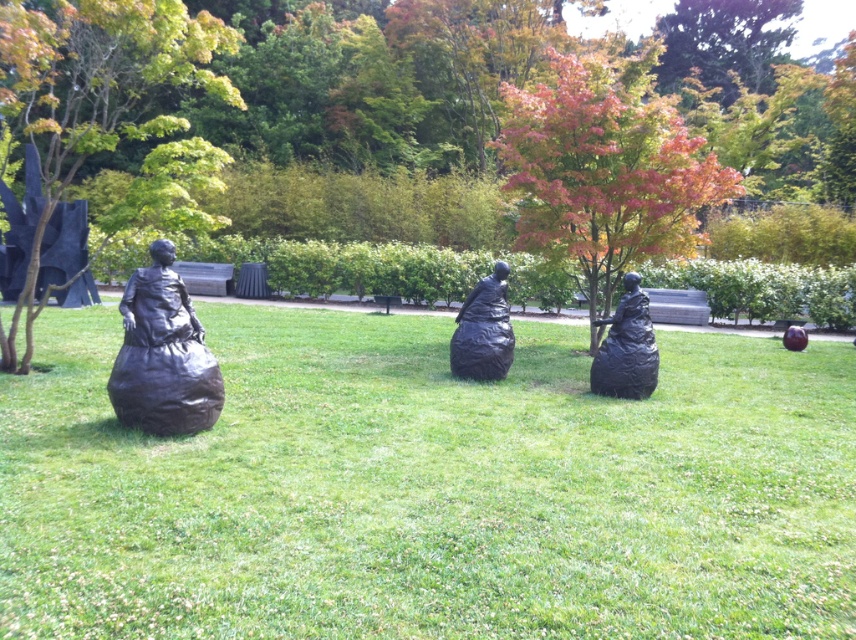
Identify the location of smooth brown tree at center. This screenshot has width=856, height=640. (485, 148).

What do you see at coordinates (485, 148) in the screenshot?
I see `smooth brown tree at center` at bounding box center [485, 148].

At what (x,y) coordinates should I click in order to perform the action: click on smooth brown tree at center. Please return your answer as a coordinate pair (x, y). The width and height of the screenshot is (856, 640). Looking at the image, I should click on (485, 148).

Can you confirm if autumn leaves at center is shorter than green leafy tree at left?

In fact, autumn leaves at center may be taller than green leafy tree at left.

Is point (538, 246) farther from viewer compared to point (0, 17)?

Yes, it is behind point (0, 17).

What are the coordinates of `autumn leaves at center` in the screenshot? It's located at (605, 168).

Who is more forward, (128,419) or (494,272)?

Point (128,419)

Does point (150, 284) come farther from viewer compared to point (489, 285)?

That is False.

What do you see at coordinates (163, 355) in the screenshot?
I see `black matte figure at left` at bounding box center [163, 355].

In order to click on black matte figure at left in this screenshot , I will do `click(163, 355)`.